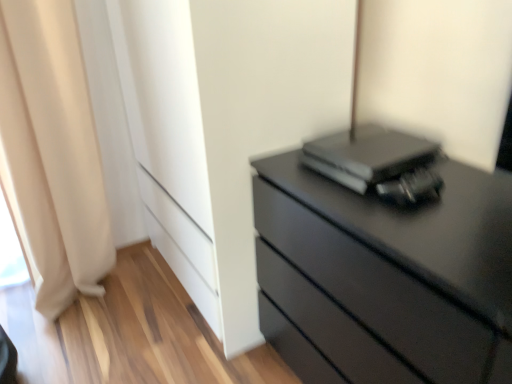
Locate an element on the screen. The width and height of the screenshot is (512, 384). vacant region in front of beige fabric curtain at left is located at coordinates (84, 339).